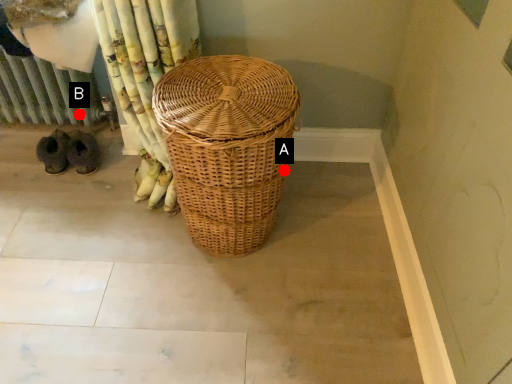
Question: Two points are circled on the image, labeled by A and B beside each circle. Which point appears farthest from the camera in this image?

Choices:
 (A) A is further
 (B) B is further

Answer: (B)